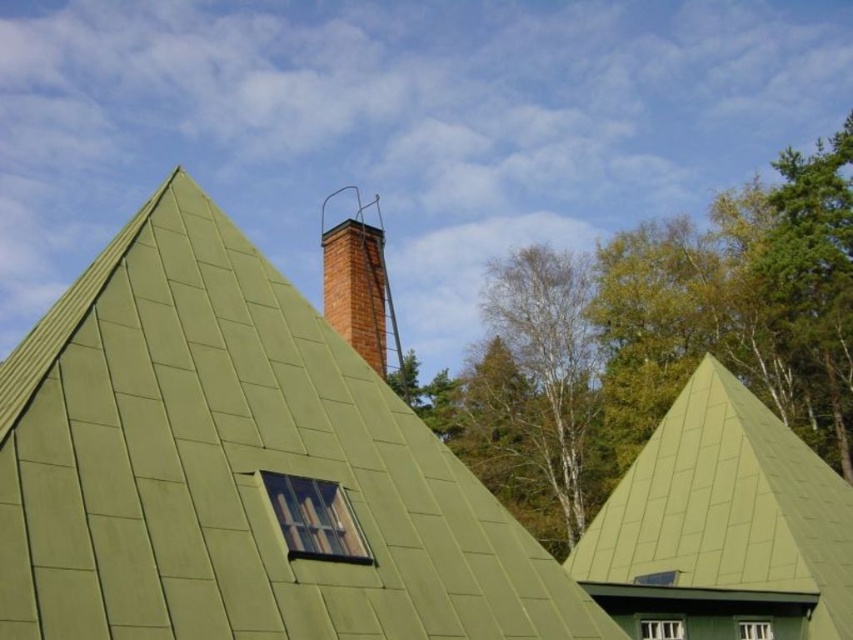
Is green matte roof at center positioned behind brick chimney at upper center?

Yes, it is.

The width and height of the screenshot is (853, 640). What are the coordinates of `green matte roof at center` in the screenshot? It's located at (728, 504).

Locate an element on the screen. This screenshot has width=853, height=640. green matte roof at center is located at coordinates (728, 504).

Who is shorter, green matte roof at center or clear glass window at center?

clear glass window at center is shorter.

Can you confirm if green matte roof at center is thinner than clear glass window at center?

No, green matte roof at center is not thinner than clear glass window at center.

Locate an element on the screen. green matte roof at center is located at coordinates (728, 504).

Measure the distance between green matte roof at center and camera.

green matte roof at center is 19.34 meters from camera.

Which is in front, point (779, 586) or point (740, 621)?

Point (740, 621)

Is point (706, 513) less distant than point (758, 627)?

No, (706, 513) is further to viewer.

Image resolution: width=853 pixels, height=640 pixels. I want to click on green matte roof at center, so (728, 504).